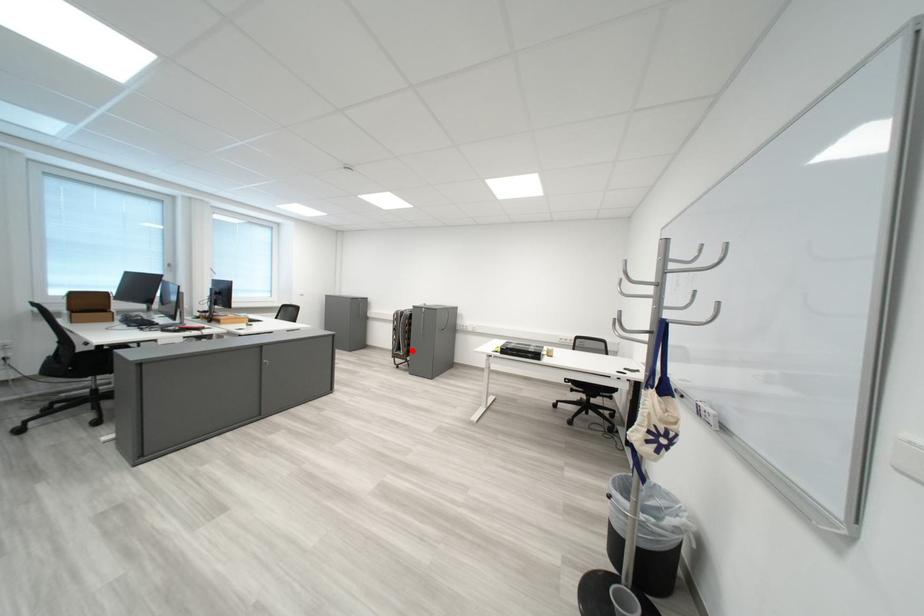
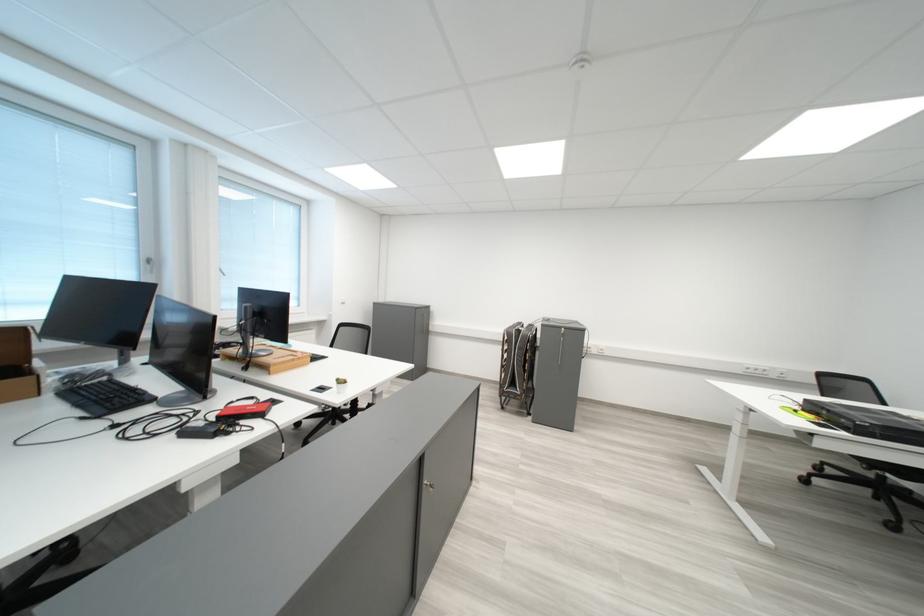
Question: I am providing you with two images of the same scene from different viewpoints. Image1 has a red point marked. In image2, the corresponding 3D location appears at what relative position? Reply with the corresponding letter.

Choices:
 (A) Closer
 (B) Farther

Answer: (B)